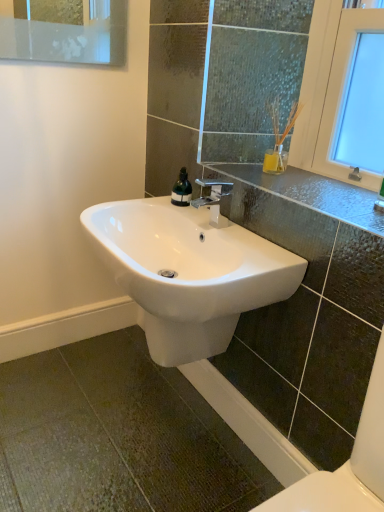
You are a GUI agent. You are given a task and a screenshot of the screen. Output one action in this format:
    pyautogui.click(x=<x>, y=<y>)
    Task: Click on the white glossy sink at center
    
    Given the screenshot: What is the action you would take?
    pyautogui.click(x=189, y=272)

The width and height of the screenshot is (384, 512). Describe the element at coordinates (182, 189) in the screenshot. I see `green glass soap dispenser at center` at that location.

This screenshot has height=512, width=384. I want to click on glossy ceramic sink at center, so click(x=311, y=193).

In terms of height, does green glass soap dispenser at center look taller or shorter compared to polished chrome faucet at center?

Clearly, green glass soap dispenser at center is shorter compared to polished chrome faucet at center.

Is green glass soap dispenser at center facing away from polished chrome faucet at center?

green glass soap dispenser at center does not have its back to polished chrome faucet at center.

Locate an element on the screen. soap dispenser on the left of polished chrome faucet at center is located at coordinates (182, 189).

Can you tell me how much green glass soap dispenser at center and polished chrome faucet at center differ in facing direction?

3.4 degrees.

Considering the positions of objects polished chrome faucet at center and glossy ceramic sink at center in the image provided, who is in front, polished chrome faucet at center or glossy ceramic sink at center?

glossy ceramic sink at center.

From the image's perspective, which is below, polished chrome faucet at center or glossy ceramic sink at center?

polished chrome faucet at center, from the image's perspective.

Between polished chrome faucet at center and glossy ceramic sink at center, which one has more height?

polished chrome faucet at center.

Is polished chrome faucet at center touching glossy ceramic sink at center?

They are not placed beside each other.

From a real-world perspective, is white glossy sink at center on top of glossy ceramic sink at center?

Incorrect, from a real-world perspective, white glossy sink at center is lower than glossy ceramic sink at center.

How different are the orientations of white glossy sink at center and glossy ceramic sink at center in degrees?

They differ by 0.127 degrees in their facing directions.

This screenshot has width=384, height=512. What are the coordinates of `sink that is on the left side of glossy ceramic sink at center` in the screenshot? It's located at (189, 272).

Could you tell me if white glossy sink at center is turned towards glossy ceramic sink at center?

No.

Considering the relative positions of white glossy sink at center and green glass soap dispenser at center in the image provided, is white glossy sink at center behind green glass soap dispenser at center?

No, white glossy sink at center is in front of green glass soap dispenser at center.

In the scene shown: Is green glass soap dispenser at center completely or partially inside white glossy sink at center?

Definitely not — green glass soap dispenser at center is not inside white glossy sink at center.

Does white glossy sink at center have a greater width compared to green glass soap dispenser at center?

Yes.

Find the location of `sink in front of the green glass soap dispenser at center`. sink in front of the green glass soap dispenser at center is located at coordinates (189, 272).

Which object is wider, white glossy sink at center or polished chrome faucet at center?

Wider between the two is white glossy sink at center.

Considering the relative positions of white glossy sink at center and polished chrome faucet at center in the image provided, is white glossy sink at center behind polished chrome faucet at center?

No, it is in front of polished chrome faucet at center.

In the scene shown: From the image's perspective, would you say white glossy sink at center is shown under polished chrome faucet at center?

Correct, white glossy sink at center appears lower than polished chrome faucet at center in the image.

Could you tell me if white glossy sink at center is facing polished chrome faucet at center?

No.

Which of these two, polished chrome faucet at center or green glass soap dispenser at center, is thinner?

With smaller width is green glass soap dispenser at center.

In the scene shown: From a real-world perspective, relative to green glass soap dispenser at center, is polished chrome faucet at center vertically above or below?

Clearly, from a real-world perspective, polished chrome faucet at center is above green glass soap dispenser at center.

Considering the sizes of objects polished chrome faucet at center and green glass soap dispenser at center in the image provided, who is bigger, polished chrome faucet at center or green glass soap dispenser at center?

With larger size is polished chrome faucet at center.

Which of these two, polished chrome faucet at center or green glass soap dispenser at center, stands shorter?

With less height is green glass soap dispenser at center.

Between glossy ceramic sink at center and white glossy sink at center, which one has more height?

white glossy sink at center is taller.

Is glossy ceramic sink at center smaller than white glossy sink at center?

Correct, glossy ceramic sink at center occupies less space than white glossy sink at center.

Is glossy ceramic sink at center facing away from white glossy sink at center?

No, glossy ceramic sink at center's orientation is not away from white glossy sink at center.

Considering the positions of point (369, 199) and point (213, 214), is point (369, 199) closer or farther from the camera than point (213, 214)?

Point (369, 199).

This screenshot has width=384, height=512. In order to click on tap located in front of the green glass soap dispenser at center in this screenshot , I will do `click(213, 199)`.

Where is `tap located behind the glossy ceramic sink at center`? This screenshot has width=384, height=512. tap located behind the glossy ceramic sink at center is located at coordinates (213, 199).

When comparing their distances from glossy ceramic sink at center, does white glossy sink at center or green glass soap dispenser at center seem closer?

white glossy sink at center.

From the image, which object appears to be nearer to glossy ceramic sink at center, white glossy sink at center or polished chrome faucet at center?

polished chrome faucet at center lies closer to glossy ceramic sink at center than the other object.

When comparing their distances from polished chrome faucet at center, does glossy ceramic sink at center or white glossy sink at center seem closer?

glossy ceramic sink at center.

From the image, which object appears to be nearer to glossy ceramic sink at center, polished chrome faucet at center or white glossy sink at center?

Among the two, polished chrome faucet at center is located nearer to glossy ceramic sink at center.

Based on their spatial positions, is white glossy sink at center or polished chrome faucet at center further from green glass soap dispenser at center?

The object further to green glass soap dispenser at center is white glossy sink at center.

Looking at the image, which one is located closer to white glossy sink at center, glossy ceramic sink at center or polished chrome faucet at center?

polished chrome faucet at center lies closer to white glossy sink at center than the other object.

Based on their spatial positions, is polished chrome faucet at center or green glass soap dispenser at center further from glossy ceramic sink at center?

green glass soap dispenser at center is positioned further to the anchor glossy ceramic sink at center.

When comparing their distances from polished chrome faucet at center, does green glass soap dispenser at center or white glossy sink at center seem further?

white glossy sink at center is further to polished chrome faucet at center.

Image resolution: width=384 pixels, height=512 pixels. I want to click on tap located between white glossy sink at center and glossy ceramic sink at center in the left-right direction, so click(213, 199).

Where is `counter top located between white glossy sink at center and green glass soap dispenser at center in the depth direction`? The image size is (384, 512). counter top located between white glossy sink at center and green glass soap dispenser at center in the depth direction is located at coordinates (311, 193).

What are the coordinates of `tap between glossy ceramic sink at center and green glass soap dispenser at center from front to back` in the screenshot? It's located at (213, 199).

At what (x,y) coordinates should I click in order to perform the action: click on tap positioned between white glossy sink at center and green glass soap dispenser at center from near to far. Please return your answer as a coordinate pair (x, y). Looking at the image, I should click on (213, 199).